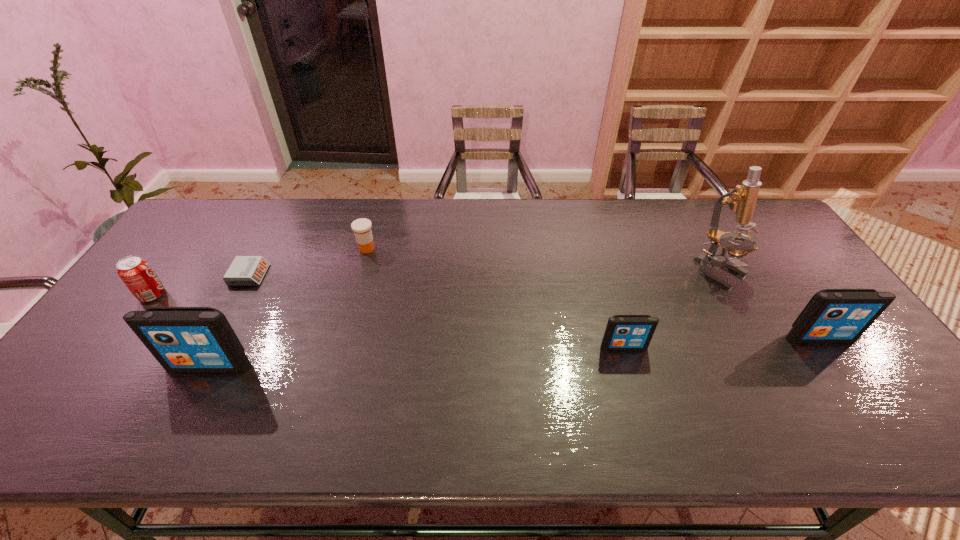
Where is `the leftmost iPod`? the leftmost iPod is located at coordinates (182, 339).

Find the location of a particular element. This screenshot has height=540, width=960. the nearest object is located at coordinates (182, 339).

Find the location of `the shortest iPod`. the shortest iPod is located at coordinates coord(623,332).

Find the location of `the second iPod from left to right`. the second iPod from left to right is located at coordinates (623, 332).

Where is `the fifth shortest object`? The image size is (960, 540). the fifth shortest object is located at coordinates (832, 315).

The image size is (960, 540). I want to click on the rightmost iPod, so click(x=832, y=315).

Locate an element on the screen. the farthest object is located at coordinates (362, 227).

Find the location of `the fourth object from left to right`. the fourth object from left to right is located at coordinates (362, 227).

Find the location of a particular element. The width and height of the screenshot is (960, 540). alarm clock is located at coordinates (244, 270).

I want to click on soda, so click(136, 273).